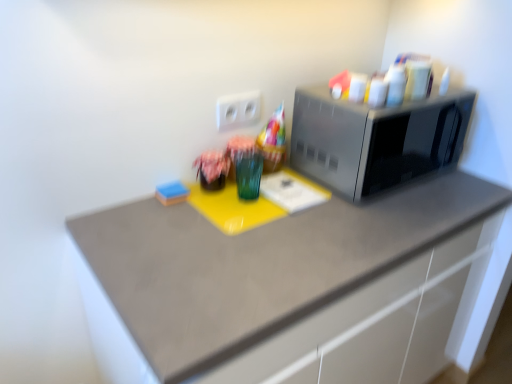
Image resolution: width=512 pixels, height=384 pixels. What do you see at coordinates (376, 139) in the screenshot? I see `satin silver microwave at right` at bounding box center [376, 139].

What do you see at coordinates (212, 165) in the screenshot? The width and height of the screenshot is (512, 384). I see `matte fabric flower at center` at bounding box center [212, 165].

What do you see at coordinates (172, 193) in the screenshot?
I see `blue sponge at lower left` at bounding box center [172, 193].

At what (x,y) coordinates should I click in order to perform the action: click on white plastic electric outlet at center. Please return your answer as a coordinate pair (x, y). This screenshot has width=512, height=384. Looking at the image, I should click on point(238,110).

This screenshot has width=512, height=384. What do you see at coordinates (289, 288) in the screenshot? I see `matte gray countertop at center` at bounding box center [289, 288].

The width and height of the screenshot is (512, 384). What are the coordinates of `satin silver microwave at right` in the screenshot? It's located at (376, 139).

Which of these two, matte gray countertop at center or matte fabric flower at center, is wider?

Wider between the two is matte gray countertop at center.

Who is bigger, matte gray countertop at center or matte fabric flower at center?

matte gray countertop at center.

Consider the image. From a real-world perspective, is matte gray countertop at center above or below matte fabric flower at center?

Clearly, from a real-world perspective, matte gray countertop at center is below matte fabric flower at center.

Is matte gray countertop at center at the left side of matte fabric flower at center?

No.

Visually, is matte fabric flower at center positioned to the left or to the right of white plastic electric outlet at center?

matte fabric flower at center is to the left of white plastic electric outlet at center.

Find the location of `electric outlet above the matte fabric flower at center (from a real-world perspective)`. electric outlet above the matte fabric flower at center (from a real-world perspective) is located at coordinates (238, 110).

Would you consider matte fabric flower at center to be distant from white plastic electric outlet at center?

No.

From the image's perspective, is green glass at center beneath white plastic electric outlet at center?

Yes, from the image's perspective, green glass at center is beneath white plastic electric outlet at center.

Is green glass at center closer to camera compared to white plastic electric outlet at center?

Yes, green glass at center is closer to the camera.

Who is bigger, green glass at center or white plastic electric outlet at center?

green glass at center.

Is green glass at center not within white plastic electric outlet at center?

Yes, green glass at center is located beyond the bounds of white plastic electric outlet at center.

Is satin silver microwave at right spatially inside matte fabric flower at center, or outside of it?

satin silver microwave at right is outside matte fabric flower at center.

Is satin silver microwave at right oriented away from matte fabric flower at center?

satin silver microwave at right does not have its back to matte fabric flower at center.

Considering the sizes of objects satin silver microwave at right and matte fabric flower at center in the image provided, who is thinner, satin silver microwave at right or matte fabric flower at center?

matte fabric flower at center.

What's the angular difference between satin silver microwave at right and matte fabric flower at center's facing directions?

They differ by 0.000311 degrees in their facing directions.

Based on the photo, is satin silver microwave at right at the right side of white plastic electric outlet at center?

Yes, satin silver microwave at right is to the right of white plastic electric outlet at center.

Is satin silver microwave at right not inside white plastic electric outlet at center?

Indeed, satin silver microwave at right is completely outside white plastic electric outlet at center.

Identify the location of electric outlet located on the left of satin silver microwave at right. (238, 110).

Could you tell me if green glass at center is facing satin silver microwave at right?

No.

Does green glass at center have a smaller size compared to satin silver microwave at right?

Correct, green glass at center occupies less space than satin silver microwave at right.

Is green glass at center at the right side of satin silver microwave at right?

No.

Does green glass at center have a greater height compared to satin silver microwave at right?

No.

Considering the sizes of objects matte fabric flower at center and matte gray countertop at center in the image provided, who is thinner, matte fabric flower at center or matte gray countertop at center?

With smaller width is matte fabric flower at center.

Is matte fabric flower at center touching matte gray countertop at center?

No, matte fabric flower at center is not in contact with matte gray countertop at center.

Measure the distance from matte fabric flower at center to matte gray countertop at center.

20.84 inches.

You are a GUI agent. You are given a task and a screenshot of the screen. Output one action in this format:
    pyautogui.click(x=<x>, y=<y>)
    Task: Click on the flower on the left of matte gray countertop at center
    The image size is (512, 384).
    Given the screenshot: What is the action you would take?
    pyautogui.click(x=212, y=165)

Identify the location of flower above the matte gray countertop at center (from the image's perspective). (212, 165).

Locate an element on the screen. The width and height of the screenshot is (512, 384). electric outlet located behind the matte fabric flower at center is located at coordinates (238, 110).

From the image, which object appears to be farther from white plastic electric outlet at center, matte gray countertop at center or matte fabric flower at center?

matte gray countertop at center lies further to white plastic electric outlet at center than the other object.

Based on their spatial positions, is matte fabric flower at center or satin silver microwave at right closer to green glass at center?

matte fabric flower at center is closer to green glass at center.

Estimate the real-world distances between objects in this image. Which object is closer to blue sponge at lower left, green glass at center or matte fabric flower at center?

matte fabric flower at center.

Which object lies nearer to the anchor point satin silver microwave at right, matte fabric flower at center or white plastic electric outlet at center?

white plastic electric outlet at center is positioned closer to the anchor satin silver microwave at right.

Looking at the image, which one is located closer to blue sponge at lower left, matte gray countertop at center or satin silver microwave at right?

matte gray countertop at center is positioned closer to the anchor blue sponge at lower left.

Looking at this image, based on their spatial positions, is green glass at center or white plastic electric outlet at center further from satin silver microwave at right?

The object further to satin silver microwave at right is green glass at center.

From the image, which object appears to be farther from matte fabric flower at center, blue sponge at lower left or matte gray countertop at center?

matte gray countertop at center.

Estimate the real-world distances between objects in this image. Which object is closer to matte gray countertop at center, matte fabric flower at center or green glass at center?

The object closer to matte gray countertop at center is green glass at center.

Where is `flower between blue sponge at lower left and satin silver microwave at right from left to right`? This screenshot has width=512, height=384. flower between blue sponge at lower left and satin silver microwave at right from left to right is located at coordinates (212, 165).

What are the coordinates of `flower between white plastic electric outlet at center and blue sponge at lower left vertically` in the screenshot? It's located at (212, 165).

Find the location of a particular element. The height and width of the screenshot is (384, 512). flower between satin silver microwave at right and matte gray countertop at center vertically is located at coordinates (212, 165).

Find the location of a particular element. glass vase between matte fabric flower at center and matte gray countertop at center in the vertical direction is located at coordinates (248, 174).